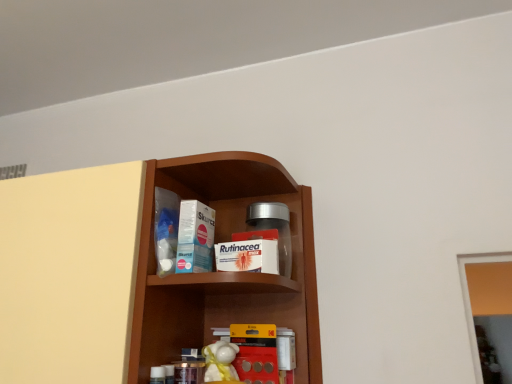
This screenshot has height=384, width=512. Describe the element at coordinates (136, 269) in the screenshot. I see `wooden cabinet at center` at that location.

This screenshot has width=512, height=384. I want to click on wooden cabinet at center, so click(x=136, y=269).

Where is `wooden cabinet at center`? The height and width of the screenshot is (384, 512). wooden cabinet at center is located at coordinates (136, 269).